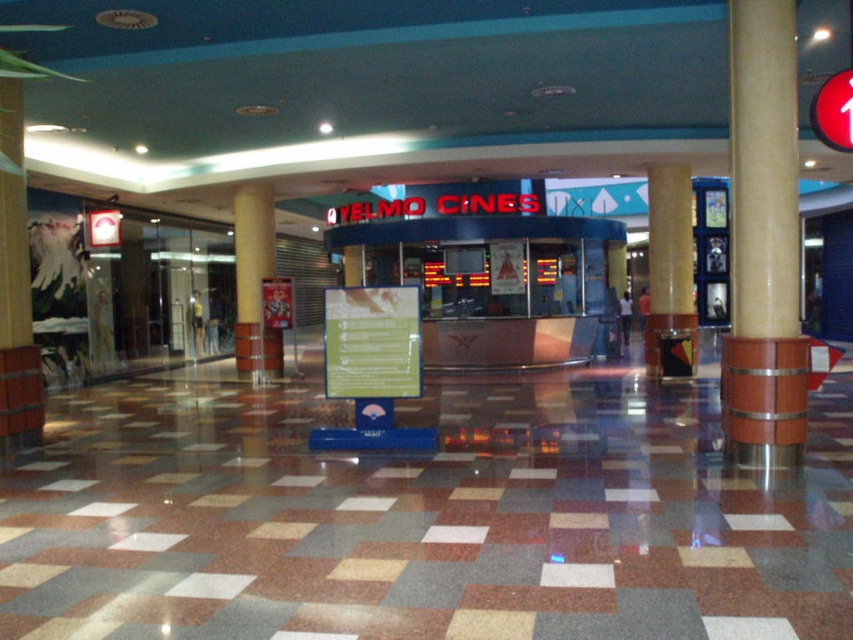
Between brown polished wood at center and brown polished pillar at center, which one is positioned lower?

brown polished wood at center

Is brown polished wood at center thinner than brown polished pillar at center?

Correct, brown polished wood at center's width is less than brown polished pillar at center's.

Who is more forward, (738,442) or (254,237)?

Point (738,442)

This screenshot has height=640, width=853. Find the location of `brown polished wood at center`. brown polished wood at center is located at coordinates (763, 241).

Who is positioned more to the left, brown polished wood at center or brown marble pillar at center?

From the viewer's perspective, brown polished wood at center appears more on the left side.

Does brown polished wood at center have a greater height compared to brown marble pillar at center?

Yes, brown polished wood at center is taller than brown marble pillar at center.

Between point (744, 416) and point (689, 284), which one is positioned in front?

Point (744, 416) is more forward.

The image size is (853, 640). What are the coordinates of `brown polished wood at center` in the screenshot? It's located at (763, 241).

Who is lower down, brown marble pillar at center or brown polished pillar at center?

brown polished pillar at center is lower down.

In order to click on brown marble pillar at center in this screenshot , I will do `click(669, 260)`.

The image size is (853, 640). I want to click on brown marble pillar at center, so click(x=669, y=260).